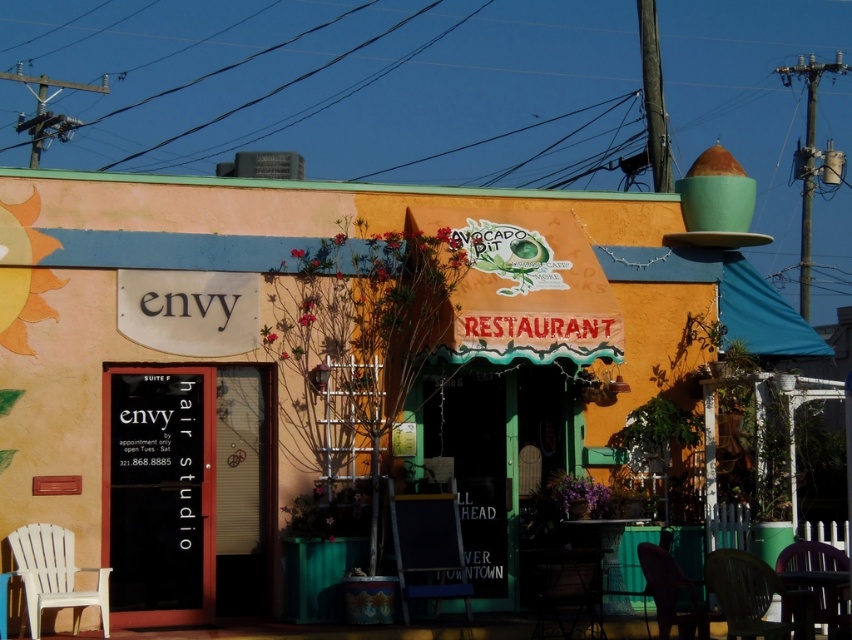
Question: Which of the following is the closest to the observer?

Choices:
 (A) (826, 602)
 (B) (694, 634)

Answer: (A)

Question: Observing the image, what is the correct spatial positioning of plastic chair at lower right in reference to purple plastic chair at lower right?

Choices:
 (A) below
 (B) above

Answer: (A)

Question: Considering the relative positions of black plastic chair at center and plastic chair at lower right in the image provided, where is black plastic chair at center located with respect to plastic chair at lower right?

Choices:
 (A) left
 (B) right

Answer: (A)

Question: Is black plastic chair at center behind white plastic chair at lower left?

Choices:
 (A) yes
 (B) no

Answer: (A)

Question: Which is nearer to the purple plastic chair at lower right?

Choices:
 (A) green plastic chair at lower right
 (B) black plastic chair at center
 (C) plastic chair at lower right
 (D) metallic dark brown chair at lower center

Answer: (A)

Question: Which of the following is the farthest from the observer?

Choices:
 (A) plastic chair at lower right
 (B) green plastic chair at lower right

Answer: (A)